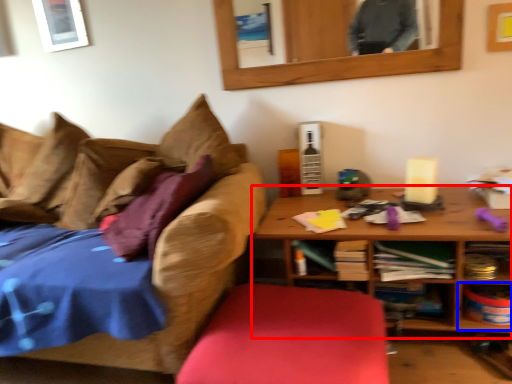
Question: Which of the following is the closest to the observer, table (highlighted by a red box) or shelf (highlighted by a blue box)?

Choices:
 (A) table
 (B) shelf

Answer: (A)